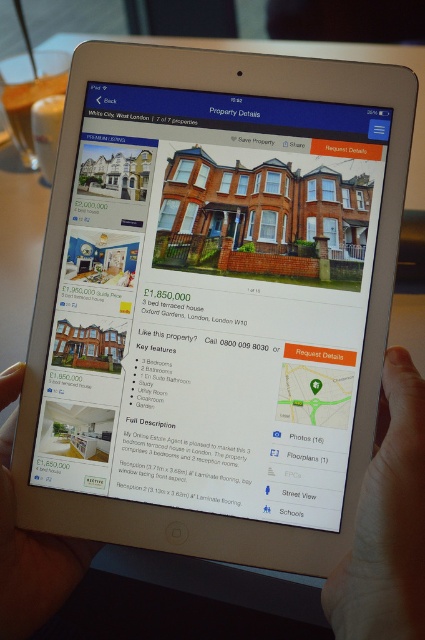
You are a real estate agent holding a tablet showing a property listing. You notice two hands touching the screen near the bottom of the tablet. The skin tone flesh hand at lower right and the matte black hand at lower left are part of your presentation. If the distance between them is 9.51 inches, can a 10.5 inch ruler placed horizontally between them fit without overlapping?

The distance between the skin tone flesh hand at lower right and the matte black hand at lower left is 9.51 inches. Since the ruler is 10.5 inches long, which is longer than the space between them, placing it horizontally would cause it to overlap both hands.

You are a real estate agent who needs to show the property details to a client. You see the skin tone flesh hand at lower right and the matte black hand at lower left on the iPad screen. Which hand is closer to the client when holding the iPad?

The skin tone flesh hand at lower right is closer to the client because it is in front of the matte black hand at lower left.

You are a real estate agent holding a skinny white tablet at center and a skin tone flesh hand at lower right. Can you determine which object is bigger?

The skinny white tablet at center is larger in size compared to the skin tone flesh hand at lower right.